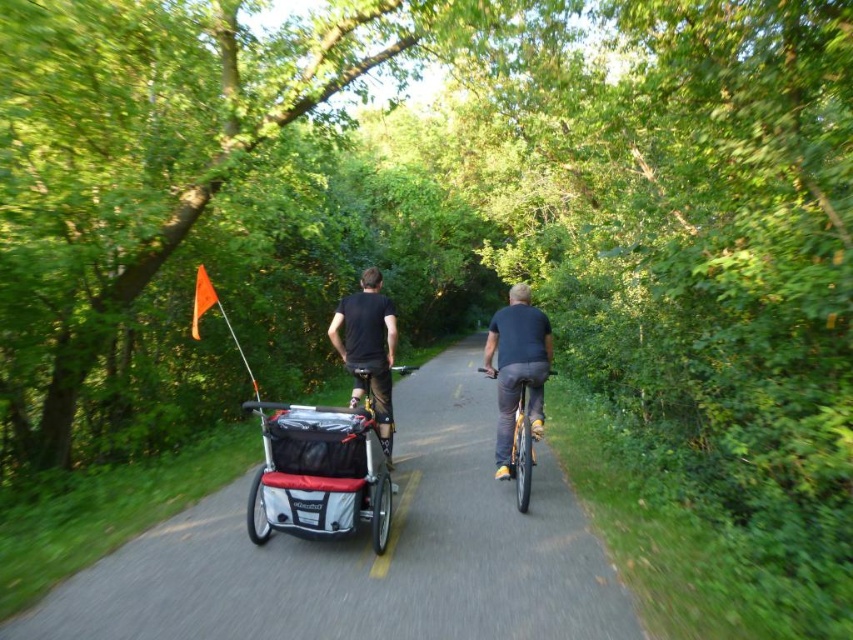
You are a drone operator trying to capture a photo of two points in the scene. The first point is at coordinate point (531,324) and the second is at point (511,435). Which point should you focus on first if you want to ensure both are in the frame without moving the drone?

Point (531,324) is closer to the viewer than point (511,435), so focusing on point (531,324) first will ensure both points are within the frame as the drone adjusts its position.

You are a cyclist on the path and want to greet the person wearing the dark blue shirt at center. Which direction should you turn to face them from the black matte shirt at center?

The dark blue shirt at center is to the right of the black matte shirt at center, so you should turn to your right to face them.